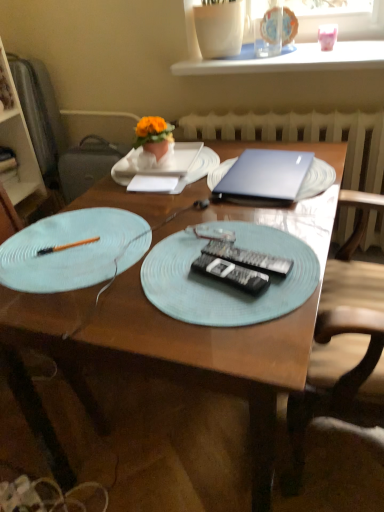
I want to click on vacant area located to the right-hand side of light blue textured plate at left, which is counted as the 2th plate, starting from the back, so click(213, 238).